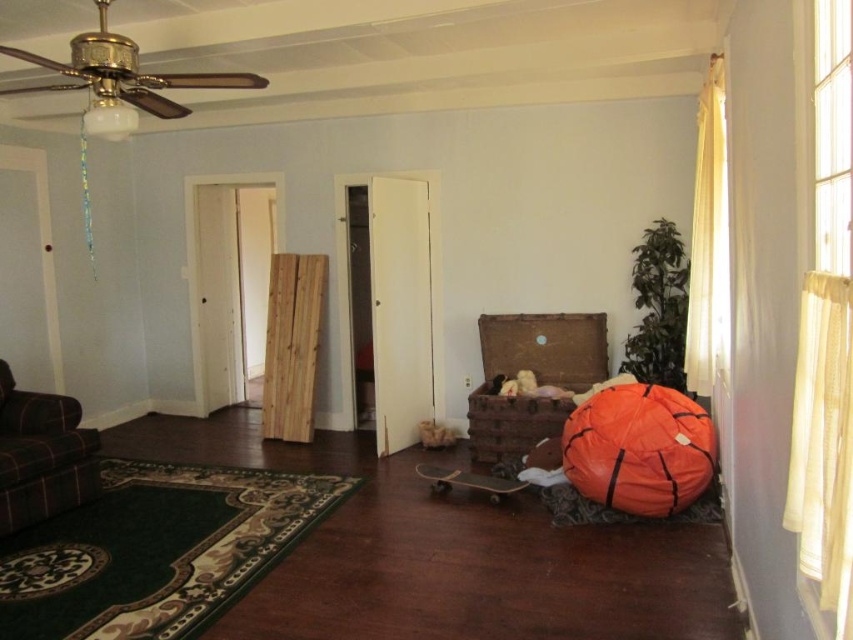
You are a delivery person who needs to place a package on the floor between the rustic wooden trunk at center and the plaid fabric couch at lower left. The package requires a minimum of 8 feet of space to be placed safely. Can you fit the package in that space?

The rustic wooden trunk at center is 8.41 feet from the plaid fabric couch at lower left, which is more than the required 8 feet. Therefore, the package can be safely placed in that space.

You are standing in the living room and want to move from the plaid fabric couch at lower left to the rustic wooden trunk at center. Which direction should you move in?

You should move to the right to reach the rustic wooden trunk at center from the plaid fabric couch at lower left since the trunk is positioned to the right of the couch.